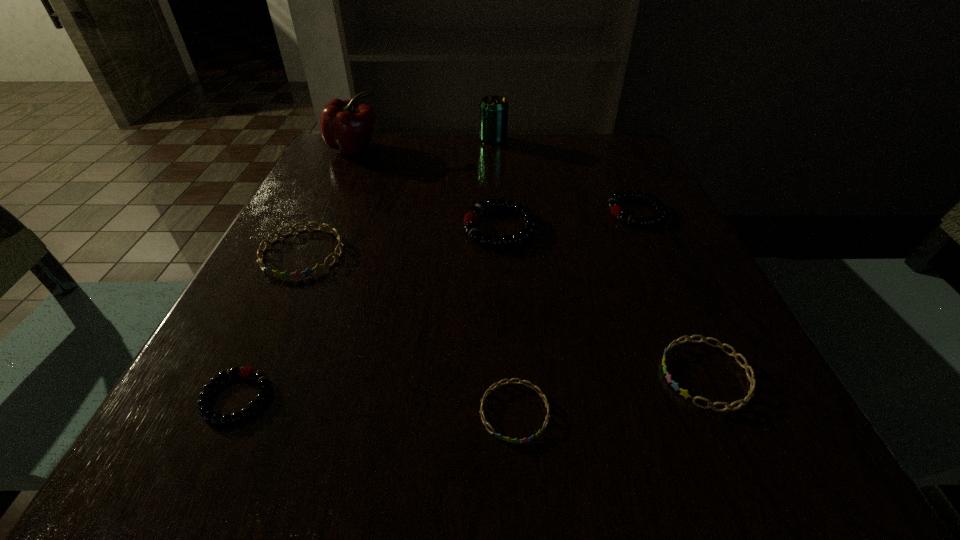
Where is `free point between the biggest blue bracelet and the beer can`? free point between the biggest blue bracelet and the beer can is located at coordinates (398, 197).

The width and height of the screenshot is (960, 540). I want to click on free spot between the second black bracelet from right to left and the second blue bracelet from right to left, so click(x=507, y=319).

Locate an element on the screen. This screenshot has width=960, height=540. vacant space in between the pink pepper and the second biggest black bracelet is located at coordinates (494, 180).

The width and height of the screenshot is (960, 540). I want to click on the sixth closest object to the rightmost black bracelet, so click(x=345, y=125).

This screenshot has width=960, height=540. In order to click on object that can be found as the third closest to the second black bracelet from right to left in this screenshot , I will do `click(752, 379)`.

The width and height of the screenshot is (960, 540). What are the coordinates of `bracelet that can be found as the third closest to the second smallest blue bracelet` in the screenshot? It's located at (616, 210).

Find the location of a particular element. The height and width of the screenshot is (540, 960). bracelet that is the fifth closest to the second black bracelet from left to right is located at coordinates (205, 411).

Locate an element on the screen. The height and width of the screenshot is (540, 960). black bracelet that is the nearest to the biggest black bracelet is located at coordinates (616, 210).

Choose which black bracelet is the third nearest neighbor to the smallest blue bracelet. Please provide its 2D coordinates. Your answer should be formatted as a tuple, i.e. [(x, y)], where the tuple contains the x and y coordinates of a point satisfying the conditions above.

[(616, 210)]

At what (x,y) coordinates should I click in order to perform the action: click on blue bracelet that is the closest to the nearest black bracelet. Please return your answer as a coordinate pair (x, y). The height and width of the screenshot is (540, 960). Looking at the image, I should click on (307, 272).